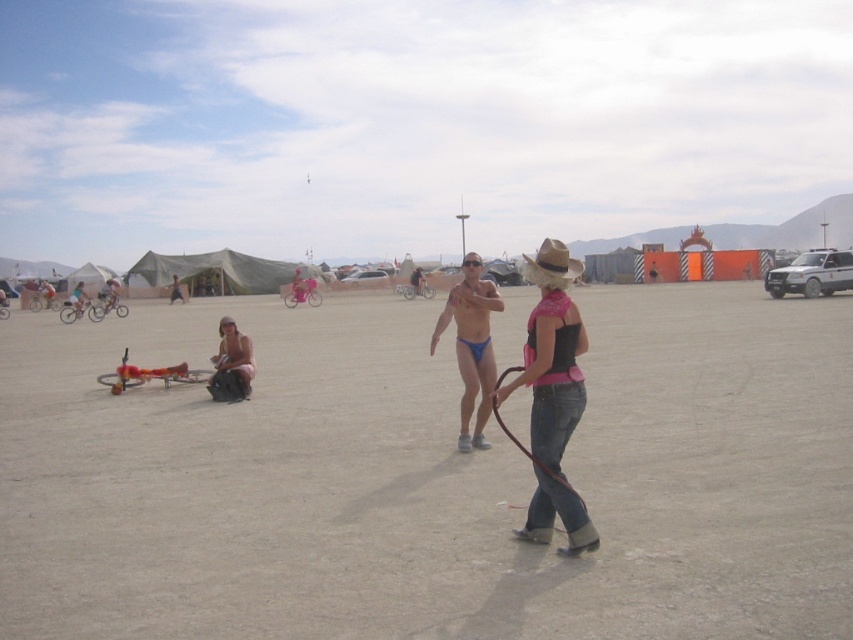
You are a photographer at the desert festival. You want to take a photo of the matte pink bikini at center and the brown straw cowboy hat at center. Which object is closer to the camera?

The matte pink bikini at center is positioned under the brown straw cowboy hat at center, so the brown straw cowboy hat at center is closer to the camera.

You are a photographer at the desert festival. You want to take a photo of the matte blue swimwear at center and the matte pink bikini at center such that both are fully visible in the frame. Given that your camera has a fixed width, which object should you position closer to the camera to ensure both fit?

To ensure both the matte blue swimwear at center and the matte pink bikini at center are fully visible, position the matte pink bikini at center closer to the camera since it is narrower than the matte blue swimwear at center.